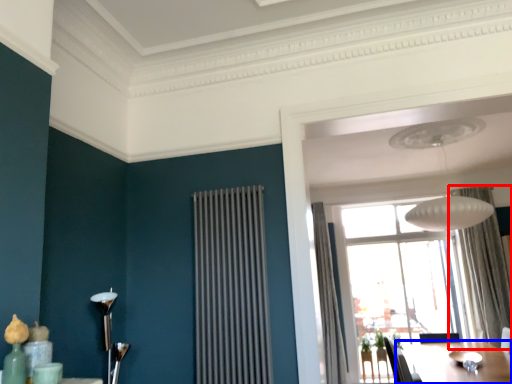
Question: Which object appears farthest to the camera in this image, curtain (highlighted by a red box) or table (highlighted by a blue box)?

Choices:
 (A) curtain
 (B) table

Answer: (A)